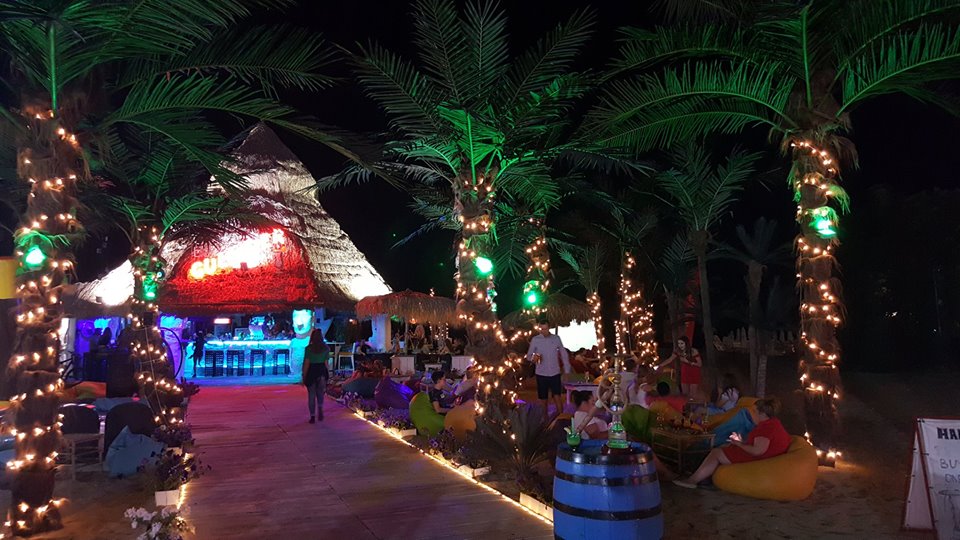
Identify the location of yellow bean bag chairs. (758, 495), (712, 421), (660, 410), (465, 413).